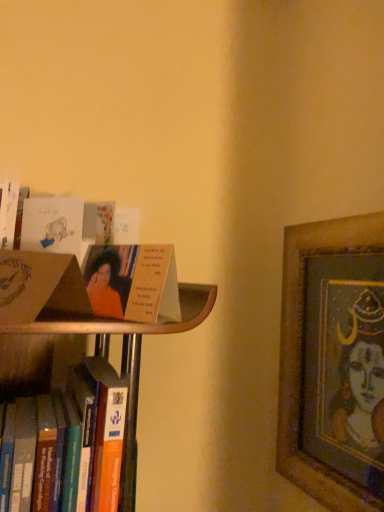
This screenshot has width=384, height=512. Identify the location of matte white card at upper left, the first paperback book when ordered from back to front. (53, 225).

In the scene shown: In order to face wooden framed artwork at right, should I rotate leftwards or rightwards?

To face it directly, rotate right by 17.058 degrees.

Measure the distance between wooden framed artwork at right and camera.

wooden framed artwork at right is 68.50 centimeters away from camera.

What is the approximate height of matte cardboard book at left, which is the 1th paperback book in front-to-back order?

matte cardboard book at left, which is the 1th paperback book in front-to-back order, is 8.32 centimeters in height.

The width and height of the screenshot is (384, 512). What do you see at coordinates (133, 283) in the screenshot? I see `matte cardboard book at upper left` at bounding box center [133, 283].

At what (x,y) coordinates should I click in order to perform the action: click on matte white card at upper left, the first paperback book in the top-to-bottom sequence. Please return your answer as a coordinate pair (x, y). This screenshot has height=512, width=384. Looking at the image, I should click on tap(53, 225).

Is matte cardboard book at left, which is the first paperback book from bottom to top, spatially inside matte white card at upper left, which is counted as the second paperback book, starting from the bottom, or outside of it?

matte cardboard book at left, which is the first paperback book from bottom to top, is not inside matte white card at upper left, which is counted as the second paperback book, starting from the bottom, it's outside.

Does matte cardboard book at left, the 2th paperback book from the top, appear on the left side of matte white card at upper left, which is counted as the second paperback book, starting from the bottom?

Yes.

Considering the positions of point (69, 263) and point (72, 213), is point (69, 263) closer or farther from the camera than point (72, 213)?

Point (69, 263) is closer to the camera than point (72, 213).

From the image's perspective, which object appears higher, matte cardboard book at left, the 2th paperback book from the top, or matte white card at upper left, which is counted as the second paperback book, starting from the bottom?

matte white card at upper left, which is counted as the second paperback book, starting from the bottom, is shown above in the image.

Would you say matte white card at upper left, the first paperback book when ordered from back to front, is inside or outside matte cardboard book at left, the 2th paperback book from the top?

matte white card at upper left, the first paperback book when ordered from back to front, is outside matte cardboard book at left, the 2th paperback book from the top.

From a real-world perspective, who is located lower, matte white card at upper left, the first paperback book in the top-to-bottom sequence, or matte cardboard book at left, which is the first paperback book from bottom to top?

In real-world perspective, matte cardboard book at left, which is the first paperback book from bottom to top, is lower.

I want to click on paperback book behind the matte cardboard book at left, which is the 1th paperback book in front-to-back order, so click(x=53, y=225).

From the image's perspective, relative to matte cardboard book at left, which is the second paperback book from back to front, is matte white card at upper left, the first paperback book when ordered from back to front, above or below?

Clearly, from the image's perspective, matte white card at upper left, the first paperback book when ordered from back to front, is above matte cardboard book at left, which is the second paperback book from back to front.

From a real-world perspective, relative to wooden framed artwork at right, is matte cardboard book at upper left vertically above or below?

Clearly, from a real-world perspective, matte cardboard book at upper left is above wooden framed artwork at right.

Does matte cardboard book at upper left have a greater height compared to wooden framed artwork at right?

Incorrect, the height of matte cardboard book at upper left is not larger of that of wooden framed artwork at right.

Consider the image. Considering the sizes of objects matte cardboard book at upper left and wooden framed artwork at right in the image provided, who is bigger, matte cardboard book at upper left or wooden framed artwork at right?

wooden framed artwork at right is bigger.

In the image, is matte cardboard book at upper left on the left side or the right side of wooden framed artwork at right?

From the image, it's evident that matte cardboard book at upper left is to the left of wooden framed artwork at right.

How far apart are wooden framed artwork at right and matte white card at upper left, the first paperback book in the top-to-bottom sequence?

The distance of wooden framed artwork at right from matte white card at upper left, the first paperback book in the top-to-bottom sequence, is 21.13 inches.

Which is more to the right, wooden framed artwork at right or matte white card at upper left, the first paperback book when ordered from back to front?

wooden framed artwork at right is more to the right.

Is wooden framed artwork at right facing away from matte white card at upper left, which is counted as the second paperback book, starting from the bottom?

No.

How different are the orientations of wooden framed artwork at right and matte white card at upper left, the second paperback book in the front-to-back sequence, in degrees?

wooden framed artwork at right and matte white card at upper left, the second paperback book in the front-to-back sequence, are facing 43.9 degrees away from each other.

Considering the sizes of matte white card at upper left, the first paperback book in the top-to-bottom sequence, and matte cardboard book at upper left in the image, is matte white card at upper left, the first paperback book in the top-to-bottom sequence, taller or shorter than matte cardboard book at upper left?

In the image, matte white card at upper left, the first paperback book in the top-to-bottom sequence, appears to be shorter than matte cardboard book at upper left.

Could you tell me if matte white card at upper left, which is counted as the second paperback book, starting from the bottom, is facing matte cardboard book at upper left?

No, matte white card at upper left, which is counted as the second paperback book, starting from the bottom, is not turned towards matte cardboard book at upper left.

Is matte white card at upper left, the second paperback book in the front-to-back sequence, positioned far away from matte cardboard book at upper left?

No, matte white card at upper left, the second paperback book in the front-to-back sequence, is not far away from matte cardboard book at upper left.

Considering the points (61, 221) and (159, 310), which point is in front, point (61, 221) or point (159, 310)?

The point (159, 310) is more forward.

Does matte white card at upper left, which is counted as the second paperback book, starting from the bottom, have a smaller size compared to wooden framed artwork at right?

Correct, matte white card at upper left, which is counted as the second paperback book, starting from the bottom, occupies less space than wooden framed artwork at right.

From the image's perspective, is matte white card at upper left, which is counted as the second paperback book, starting from the bottom, beneath wooden framed artwork at right?

Actually, matte white card at upper left, which is counted as the second paperback book, starting from the bottom, appears above wooden framed artwork at right in the image.

Between point (54, 208) and point (332, 374), which one is positioned behind?

Positioned behind is point (332, 374).

How many degrees apart are the facing directions of matte white card at upper left, the first paperback book when ordered from back to front, and wooden framed artwork at right?

There is a 43.9-degree angle between the facing directions of matte white card at upper left, the first paperback book when ordered from back to front, and wooden framed artwork at right.

Is matte cardboard book at left, the 2th paperback book from the top, to the left or to the right of wooden framed artwork at right in the image?

matte cardboard book at left, the 2th paperback book from the top, is positioned on wooden framed artwork at right's left side.

In the scene shown: Which of these two, matte cardboard book at left, the 2th paperback book from the top, or wooden framed artwork at right, is wider?

Wider between the two is matte cardboard book at left, the 2th paperback book from the top.

Find the location of `picture frame beneath the matte cardboard book at left, the 2th paperback book from the top (from a real-world perspective)`. picture frame beneath the matte cardboard book at left, the 2th paperback book from the top (from a real-world perspective) is located at coordinates (333, 362).

Who is shorter, matte cardboard book at left, the 2th paperback book from the top, or wooden framed artwork at right?

matte cardboard book at left, the 2th paperback book from the top, is shorter.

The image size is (384, 512). Identify the location of paperback book located on the left of matte white card at upper left, the first paperback book when ordered from back to front. (41, 287).

Find the location of a particular element. The image size is (384, 512). paperback book in front of the matte white card at upper left, the second paperback book in the front-to-back sequence is located at coordinates (41, 287).

Which object lies nearer to the anchor point wooden framed artwork at right, matte cardboard book at upper left or matte white card at upper left, the first paperback book in the top-to-bottom sequence?

Among the two, matte cardboard book at upper left is located nearer to wooden framed artwork at right.

Which object lies further to the anchor point matte white card at upper left, the first paperback book when ordered from back to front, wooden framed artwork at right or matte cardboard book at left, the 2th paperback book from the top?

wooden framed artwork at right lies further to matte white card at upper left, the first paperback book when ordered from back to front, than the other object.

Estimate the real-world distances between objects in this image. Which object is further from matte cardboard book at left, the 2th paperback book from the top, wooden framed artwork at right or matte white card at upper left, the first paperback book in the top-to-bottom sequence?

wooden framed artwork at right.

Which object lies further to the anchor point matte cardboard book at left, which is the 1th paperback book in front-to-back order, matte white card at upper left, the first paperback book when ordered from back to front, or wooden framed artwork at right?

wooden framed artwork at right is further to matte cardboard book at left, which is the 1th paperback book in front-to-back order.

Which object lies further to the anchor point matte white card at upper left, which is counted as the second paperback book, starting from the bottom, matte cardboard book at left, which is the 1th paperback book in front-to-back order, or wooden framed artwork at right?

wooden framed artwork at right lies further to matte white card at upper left, which is counted as the second paperback book, starting from the bottom, than the other object.

Consider the image. When comparing their distances from matte cardboard book at upper left, does wooden framed artwork at right or matte white card at upper left, the second paperback book in the front-to-back sequence, seem further?

wooden framed artwork at right is positioned further to the anchor matte cardboard book at upper left.

Estimate the real-world distances between objects in this image. Which object is further from matte white card at upper left, which is counted as the second paperback book, starting from the bottom, matte cardboard book at upper left or matte cardboard book at left, which is the 1th paperback book in front-to-back order?

Based on the image, matte cardboard book at left, which is the 1th paperback book in front-to-back order, appears to be further to matte white card at upper left, which is counted as the second paperback book, starting from the bottom.

When comparing their distances from matte cardboard book at upper left, does matte cardboard book at left, which is the first paperback book from bottom to top, or wooden framed artwork at right seem closer?

Based on the image, matte cardboard book at left, which is the first paperback book from bottom to top, appears to be nearer to matte cardboard book at upper left.

The width and height of the screenshot is (384, 512). Identify the location of paperback book located between matte cardboard book at left, the 2th paperback book from the top, and wooden framed artwork at right in the left-right direction. (53, 225).

This screenshot has height=512, width=384. What are the coordinates of `book between matte white card at upper left, the first paperback book in the top-to-bottom sequence, and wooden framed artwork at right, in the horizontal direction` in the screenshot? It's located at (133, 283).

Locate an element on the screen. book between matte cardboard book at left, which is the 1th paperback book in front-to-back order, and wooden framed artwork at right from left to right is located at coordinates (133, 283).

You are a GUI agent. You are given a task and a screenshot of the screen. Output one action in this format:
    pyautogui.click(x=<x>, y=<y>)
    Task: Click on the paperback book situated between matte cardboard book at left, which is the 1th paperback book in front-to-back order, and matte cardboard book at upper left from left to right
    The width and height of the screenshot is (384, 512).
    Given the screenshot: What is the action you would take?
    pyautogui.click(x=53, y=225)